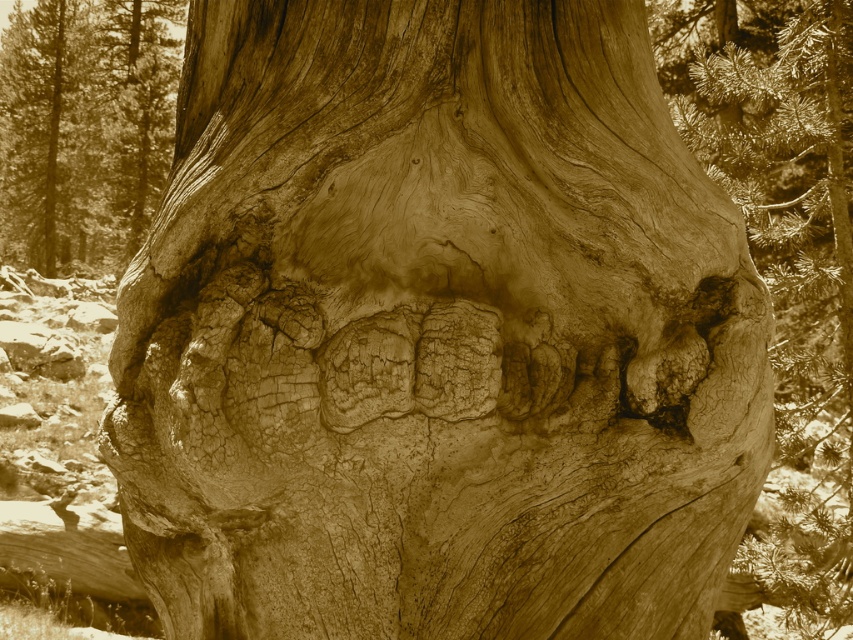
Question: From the image, what is the correct spatial relationship of rough bark tree trunk at center in relation to rough textured bark at center?

Choices:
 (A) left
 (B) right

Answer: (B)

Question: Can you confirm if rough bark tree trunk at center is positioned to the right of rough textured bark at center?

Choices:
 (A) yes
 (B) no

Answer: (A)

Question: Is rough bark tree trunk at center closer to the viewer compared to rough textured bark at center?

Choices:
 (A) yes
 (B) no

Answer: (A)